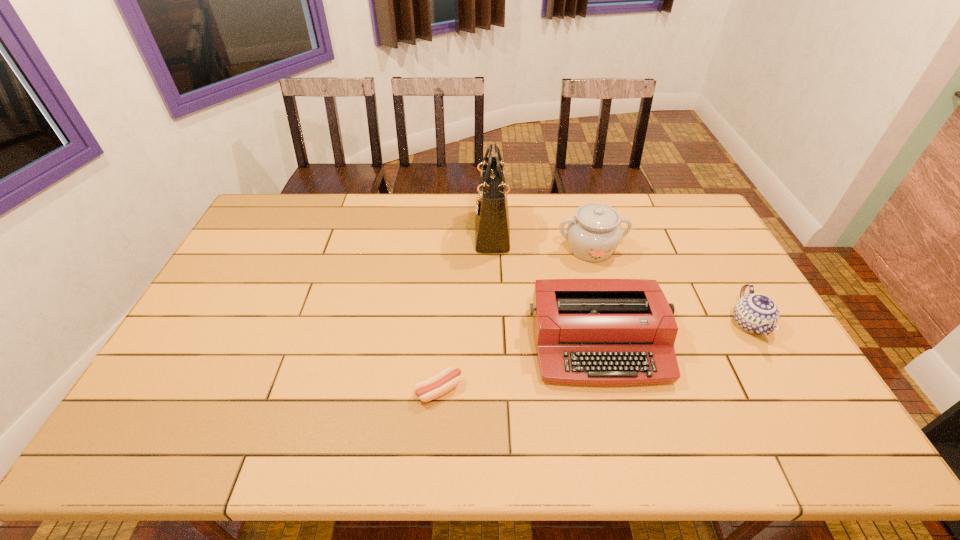
Where is `free spot located at the front of the tallest object with visible charms`? This screenshot has width=960, height=540. free spot located at the front of the tallest object with visible charms is located at coordinates (386, 231).

The width and height of the screenshot is (960, 540). Find the location of `free region located 0.190m at the front of the tallest object with visible charms`. free region located 0.190m at the front of the tallest object with visible charms is located at coordinates (422, 231).

Find the location of a particular element. This screenshot has height=540, width=960. vacant space located on the front of the second tallest object is located at coordinates (618, 349).

The width and height of the screenshot is (960, 540). I want to click on free space located 0.270m at the spout of the right chinaware, so click(x=819, y=446).

At what (x,y) coordinates should I click in order to perform the action: click on vacant space located 0.280m on the back of the leftmost object. Please return your answer as a coordinate pair (x, y). Looking at the image, I should click on (445, 296).

At what (x,y) coordinates should I click in order to perform the action: click on object located at the far edge. Please return your answer as a coordinate pair (x, y). Looking at the image, I should click on (492, 229).

This screenshot has height=540, width=960. In order to click on object at the right edge in this screenshot , I will do `click(757, 313)`.

You are a GUI agent. You are given a task and a screenshot of the screen. Output one action in this format:
    pyautogui.click(x=<x>, y=<y>)
    Task: Click on the vacant space at the far edge
    
    Given the screenshot: What is the action you would take?
    pyautogui.click(x=589, y=195)

Locate an element on the screen. This screenshot has height=540, width=960. vacant region at the near edge of the desktop is located at coordinates (406, 440).

Find the location of a particular element. This screenshot has height=540, width=960. vacant space at the left edge of the desktop is located at coordinates (264, 241).